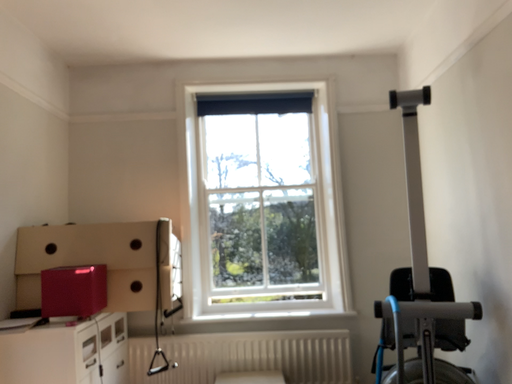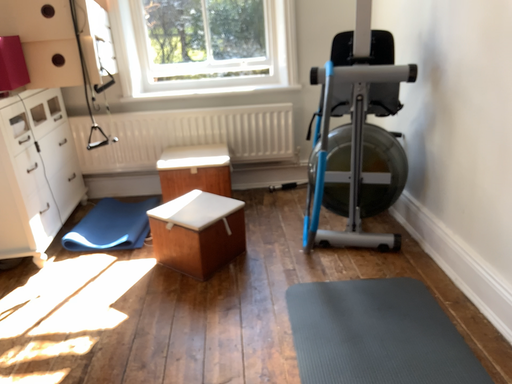
Question: How did the camera likely rotate when shooting the video?

Choices:
 (A) rotated downward
 (B) rotated upward

Answer: (A)